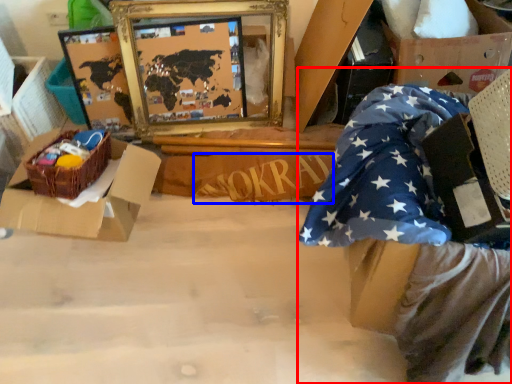
Question: Which object is further to the camera taking this photo, person (highlighted by a red box) or writing (highlighted by a blue box)?

Choices:
 (A) person
 (B) writing

Answer: (B)